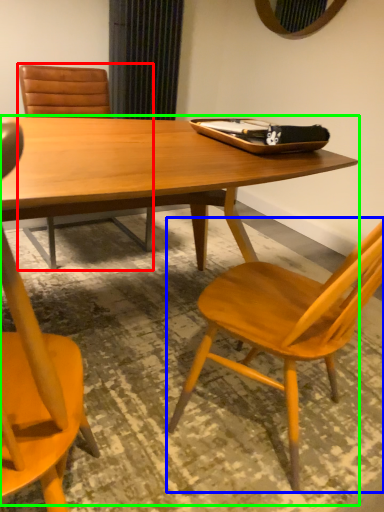
Question: Considering the real-world distances, which object is closest to chair (highlighted by a red box)? chair (highlighted by a blue box) or round table (highlighted by a green box).

Choices:
 (A) chair
 (B) round table

Answer: (B)